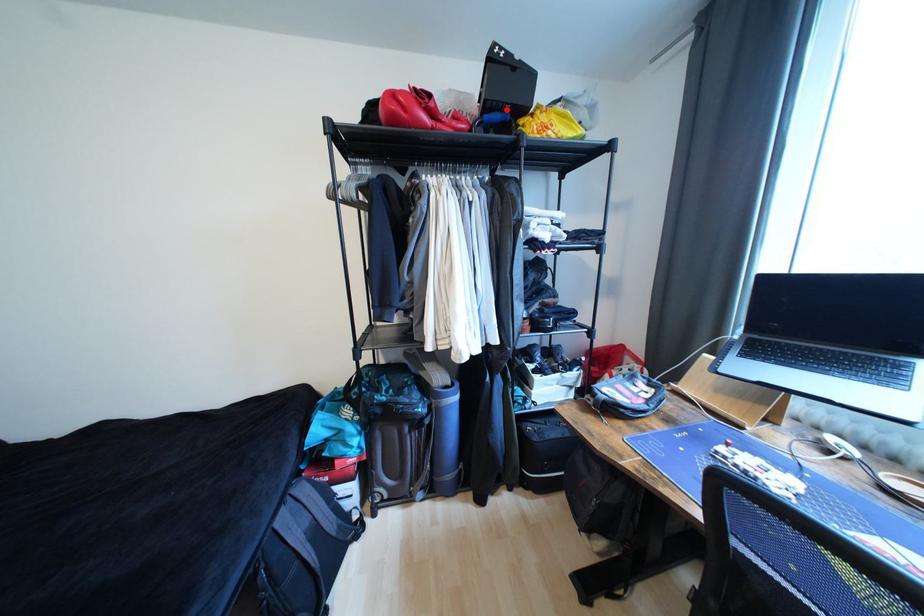
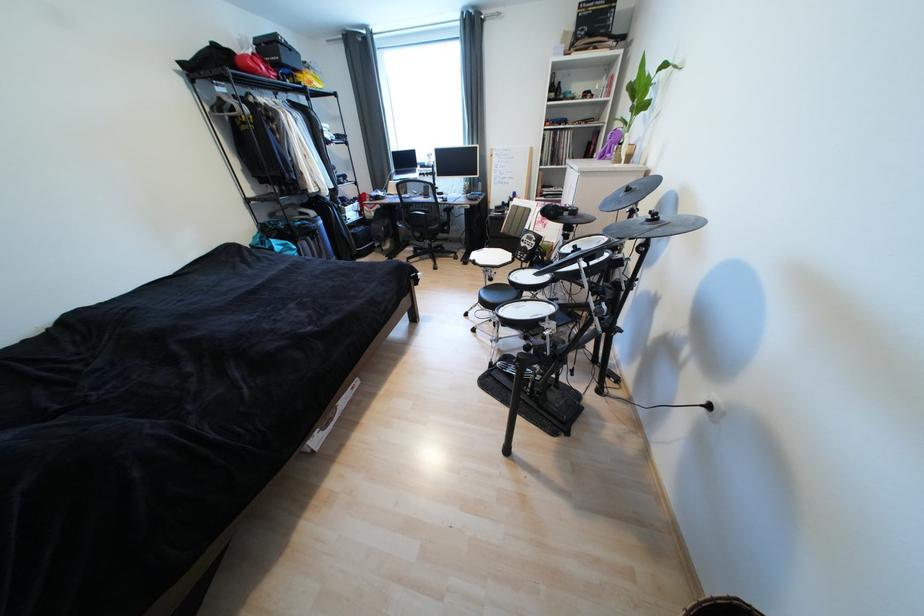
Locate, in the second image, the point that corresponds to the highlighted location in the first image.

(294, 68)